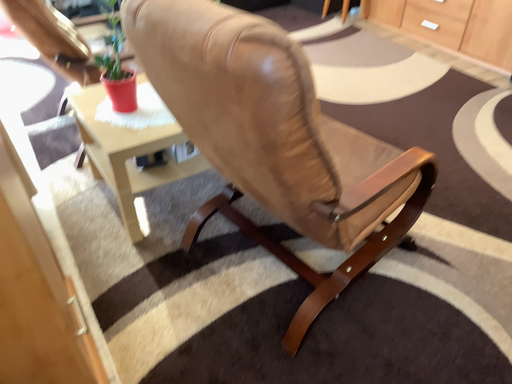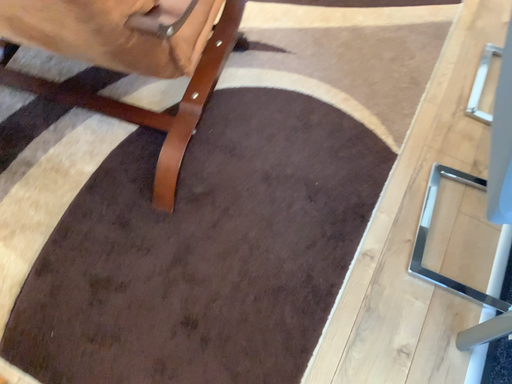
Question: How did the camera likely rotate when shooting the video?

Choices:
 (A) rotated right
 (B) rotated left

Answer: (A)